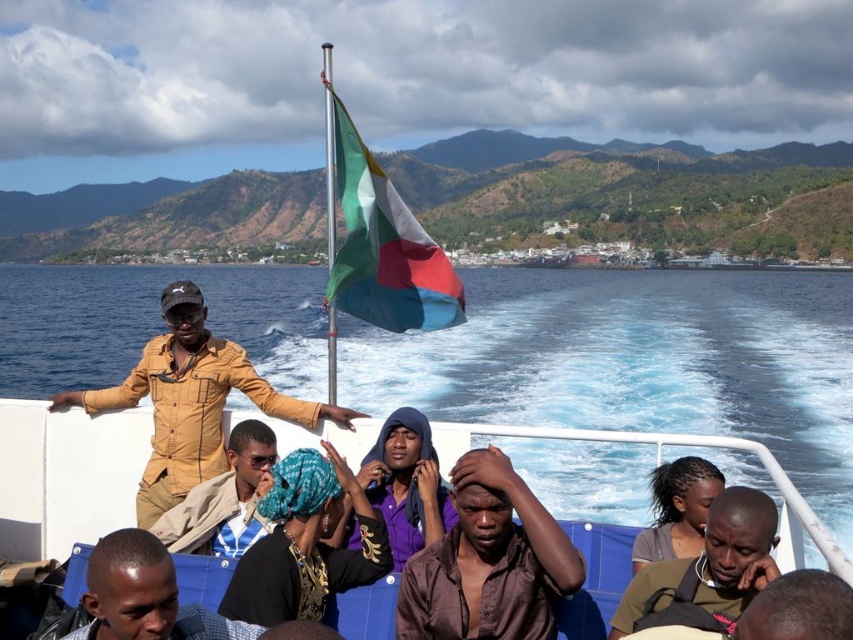
You are standing on the ferry and want to move from the point at coordinates point (387, 259) to the point at coordinates point (698, 573). Which direction should you walk to reach your destination?

Since point (387, 259) is behind point (698, 573), you should walk forward to reach point (698, 573) from point (387, 259).

You are standing on the ferry and want to take a photo of the point at coordinates (334,307). If your camera has a maximum focus range of 70 feet, will you be able to focus on that point?

The distance of point (334,307) from the camera is 71.92 feet, which exceeds the camera maximum focus range of 70 feet. Therefore, you won not be able to focus on that point.

You are a photographer standing on the ferry and want to capture a photo that includes both the matte yellow shirt at upper left and the purple matte clothing at center. Given that your camera has a maximum focus range of 2 meters, will you be able to get both subjects in focus without moving your position?

The matte yellow shirt at upper left is 2.81 meters away from the purple matte clothing at center. Since the distance between them exceeds the camera maximum focus range of 2 meters, you cannot get both subjects in focus without moving your position.